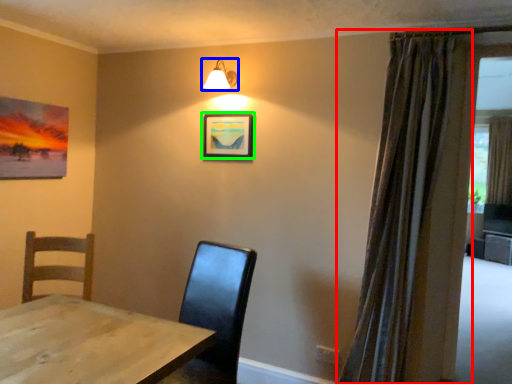
Question: Estimate the real-world distances between objects in this image. Which object is farther from curtain (highlighted by a red box), lamp (highlighted by a blue box) or picture frame (highlighted by a green box)?

Choices:
 (A) lamp
 (B) picture frame

Answer: (A)